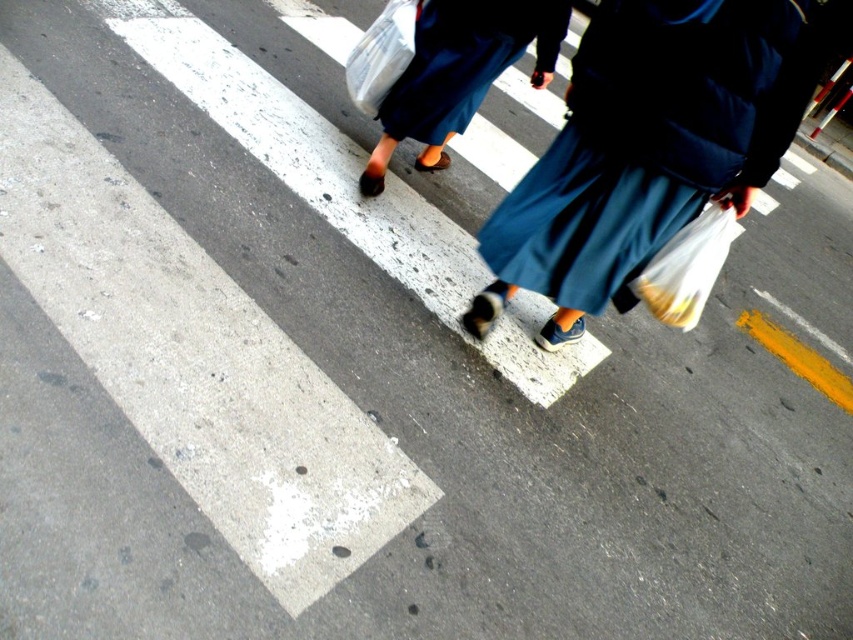
Who is higher up, blue fabric skirt at center or translucent plastic bag at upper center?

translucent plastic bag at upper center is higher up.

Which of these two, blue fabric skirt at center or translucent plastic bag at upper center, stands shorter?

translucent plastic bag at upper center is shorter.

Which is in front, point (738, 74) or point (370, 56)?

Point (738, 74) is in front.

I want to click on blue fabric skirt at center, so [x=648, y=147].

Can you confirm if translucent plastic bag at lower right is thinner than translucent plastic bag at upper center?

Yes.

Measure the distance from translucent plastic bag at lower right to translucent plastic bag at upper center.

4.22 feet

This screenshot has width=853, height=640. I want to click on translucent plastic bag at lower right, so click(686, 268).

Between point (587, 186) and point (701, 298), which one is positioned in front?

Point (587, 186) is in front.

Who is positioned more to the left, blue fabric skirt at center or translucent plastic bag at lower right?

Positioned to the left is blue fabric skirt at center.

Where is `blue fabric skirt at center`? This screenshot has height=640, width=853. blue fabric skirt at center is located at coordinates (648, 147).